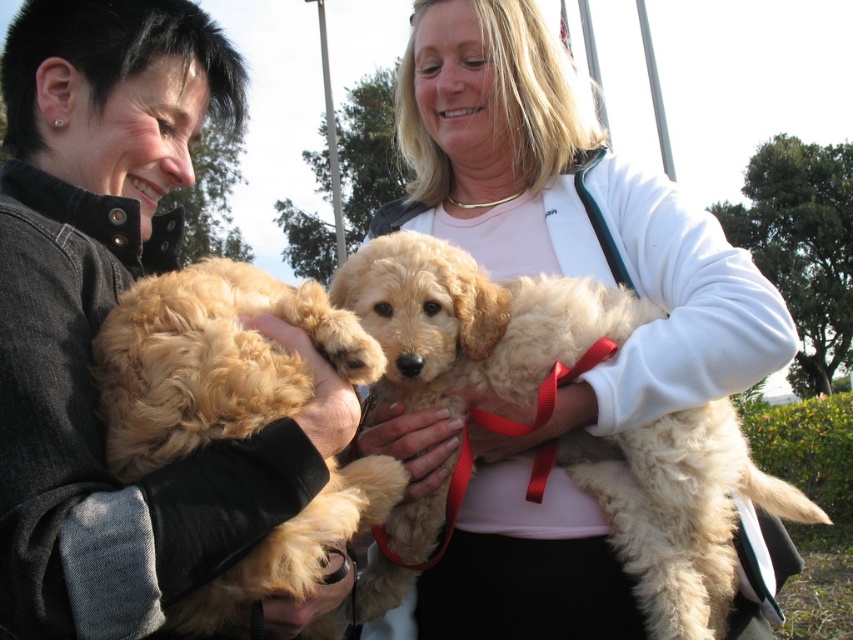
Is fluffy golden fur at left below fluffy beige puppy at center?

No, fluffy golden fur at left is not below fluffy beige puppy at center.

Who is more forward, (54, 419) or (451, 516)?

Point (54, 419) is in front.

Identify the location of fluffy golden fur at left. (103, 316).

The image size is (853, 640). What are the coordinates of `fluffy golden fur at left` in the screenshot? It's located at (103, 316).

Who is positioned more to the left, fluffy beige puppy at center or golden fur puppy at left?

golden fur puppy at left

Where is `fluffy beige puppy at center`? fluffy beige puppy at center is located at coordinates (474, 321).

Locate an element on the screen. The width and height of the screenshot is (853, 640). fluffy beige puppy at center is located at coordinates (474, 321).

In the scene shown: Who is positioned more to the right, fluffy golden fur at left or golden fur puppy at left?

golden fur puppy at left

Does fluffy golden fur at left appear under golden fur puppy at left?

No, fluffy golden fur at left is not below golden fur puppy at left.

Between point (154, 157) and point (167, 285), which one is positioned in front?

Point (167, 285) is in front.

Find the location of a particular element. Image resolution: width=853 pixels, height=640 pixels. fluffy golden fur at left is located at coordinates (103, 316).